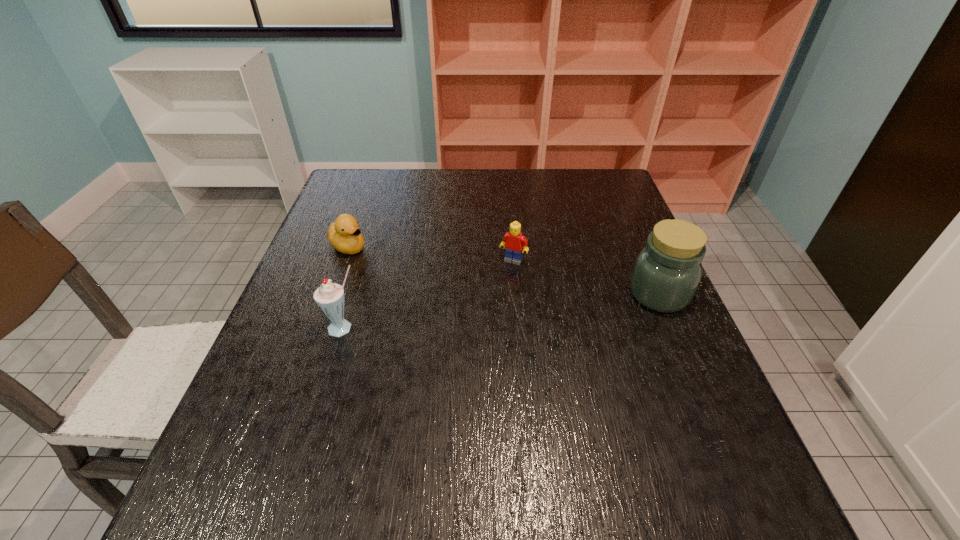
At what (x,y) coordinates should I click in order to perform the action: click on free spot on the desktop that is between the nearest object and the jar and is positioned on the face of the duckling. Please return your answer as a coordinate pair (x, y). Looking at the image, I should click on (460, 315).

Image resolution: width=960 pixels, height=540 pixels. What are the coordinates of `vacant space on the desktop that is between the nearest object and the jar and is positioned on the front-facing side of the second object from right to left` in the screenshot? It's located at (487, 313).